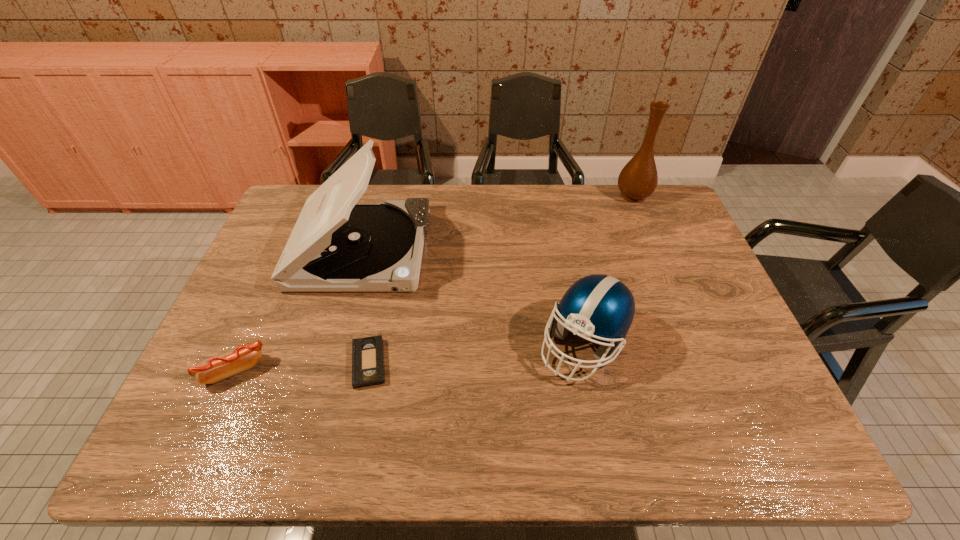
The width and height of the screenshot is (960, 540). Find the location of `the rightmost object`. the rightmost object is located at coordinates (638, 179).

Where is `vase`? This screenshot has height=540, width=960. vase is located at coordinates (638, 179).

Find the location of `CD player`. CD player is located at coordinates (336, 245).

Locate an element on the screen. The width and height of the screenshot is (960, 540). football helmet is located at coordinates (601, 307).

Image resolution: width=960 pixels, height=540 pixels. I want to click on the fourth object from left to right, so click(x=601, y=307).

In order to click on sausage in this screenshot , I will do `click(211, 370)`.

In order to click on videotape in this screenshot , I will do [368, 369].

The width and height of the screenshot is (960, 540). Find the location of `vacant region located on the left of the farthest object`. vacant region located on the left of the farthest object is located at coordinates (543, 195).

At what (x,y) coordinates should I click in order to perform the action: click on free space located 0.120m on the control panel of the second farthest object. Please return your answer as a coordinate pair (x, y). The width and height of the screenshot is (960, 540). Looking at the image, I should click on (466, 249).

The height and width of the screenshot is (540, 960). Identify the location of blank area located 0.140m at the front of the fourth object from left to right with the faceguard. (604, 448).